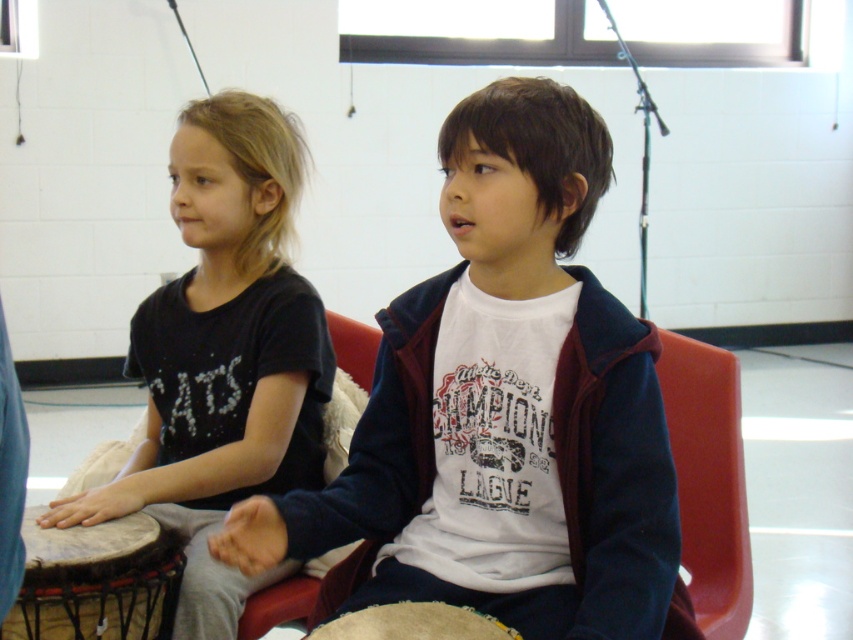
Does black matte shirt at left appear on the left side of natural wood drum at lower left?

No, black matte shirt at left is not to the left of natural wood drum at lower left.

Which is above, black matte shirt at left or natural wood drum at lower left?

Positioned higher is black matte shirt at left.

Is point (231, 314) less distant than point (170, 582)?

No, it is behind (170, 582).

I want to click on black matte shirt at left, so click(x=223, y=355).

Can you confirm if black matte shirt at left is bigger than beige textured drum at center?

Yes.

Measure the distance between point (271, 378) and camera.

1.85 meters

The height and width of the screenshot is (640, 853). What do you see at coordinates (223, 355) in the screenshot? I see `black matte shirt at left` at bounding box center [223, 355].

Where is `black matte shirt at left`? Image resolution: width=853 pixels, height=640 pixels. black matte shirt at left is located at coordinates (223, 355).

Consider the image. Can you confirm if white cotton shirt at center is positioned below black matte shirt at left?

Yes, white cotton shirt at center is below black matte shirt at left.

Is white cotton shirt at center smaller than black matte shirt at left?

Yes.

Does point (608, 422) come closer to viewer compared to point (221, 612)?

Yes, it is.

Where is `white cotton shirt at center`? white cotton shirt at center is located at coordinates (503, 410).